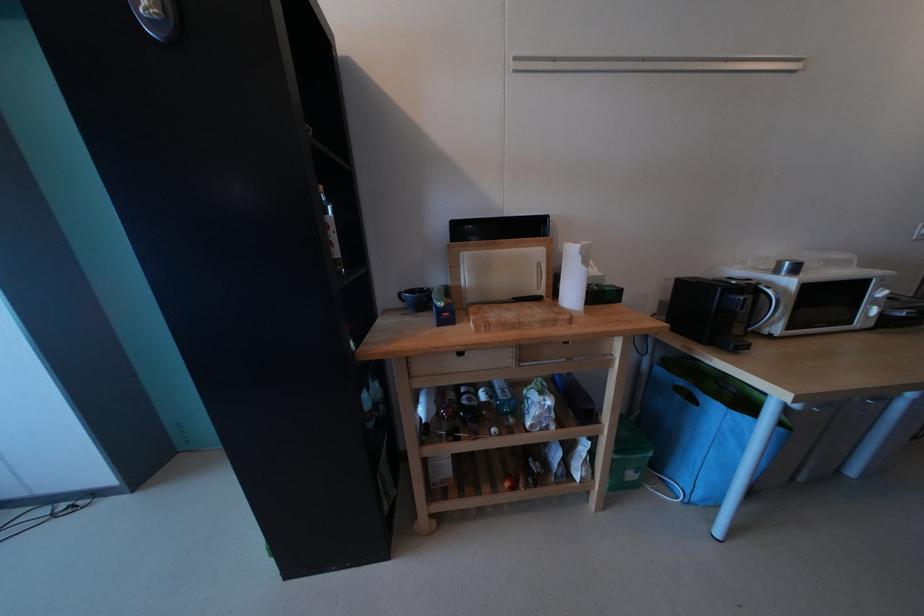
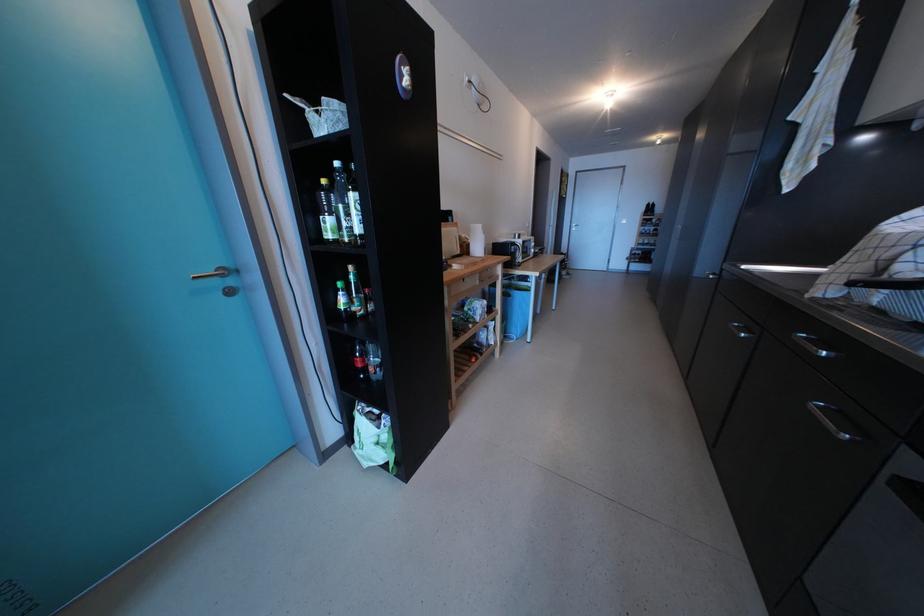
Locate, in the second image, the point that corresponds to pixel 606 446 in the first image.

(507, 326)